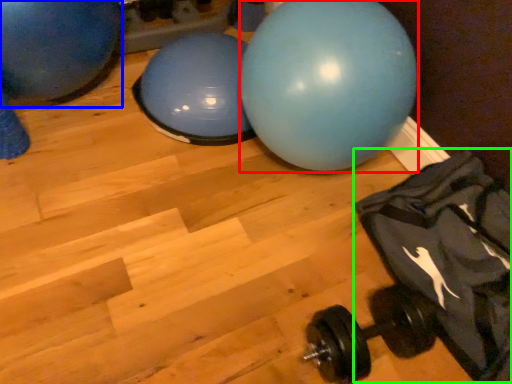
Question: Based on their relative distances, which object is farther from ball (highlighted by a red box)? Choose from ball (highlighted by a blue box) and bean bag chair (highlighted by a green box).

Choices:
 (A) ball
 (B) bean bag chair

Answer: (A)